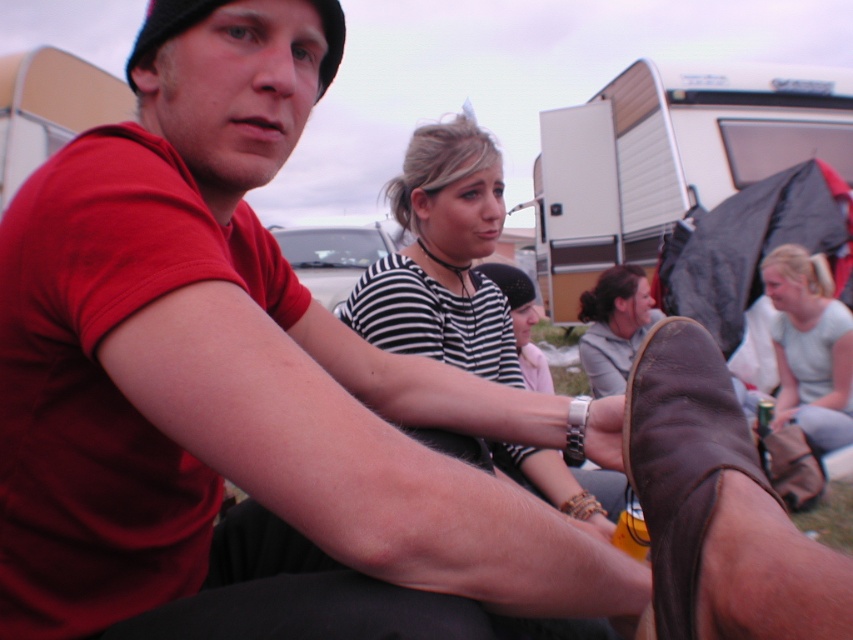
Between striped fabric shirt at center and light gray cotton shirt at lower right, which one has less height?

With less height is light gray cotton shirt at lower right.

Is point (474, 323) farther from viewer compared to point (834, 353)?

No, it is not.

Between point (425, 300) and point (845, 397), which one is positioned behind?

The point (845, 397) is more distant.

The width and height of the screenshot is (853, 640). I want to click on striped fabric shirt at center, so (442, 259).

Does brown leather shoe at lower right appear on the left side of striped fabric shirt at center?

In fact, brown leather shoe at lower right is to the right of striped fabric shirt at center.

Is brown leather shoe at lower right thinner than striped fabric shirt at center?

Yes, brown leather shoe at lower right is thinner than striped fabric shirt at center.

Who is more forward, (x=775, y=508) or (x=428, y=273)?

Point (x=775, y=508) is in front.

The width and height of the screenshot is (853, 640). In order to click on brown leather shoe at lower right in this screenshot , I will do `click(717, 506)`.

Is light gray cotton shirt at lower right above gray fabric jacket at lower right?

Incorrect, light gray cotton shirt at lower right is not positioned above gray fabric jacket at lower right.

Does light gray cotton shirt at lower right have a lesser height compared to gray fabric jacket at lower right?

No, light gray cotton shirt at lower right is not shorter than gray fabric jacket at lower right.

Who is more distant from viewer, (831, 298) or (621, 358)?

Positioned behind is point (831, 298).

The height and width of the screenshot is (640, 853). I want to click on light gray cotton shirt at lower right, so click(x=809, y=346).